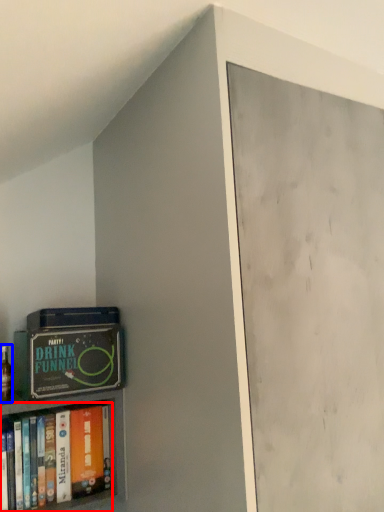
Question: Which object appears closest to the camera in this image, book (highlighted by a red box) or alcohol (highlighted by a blue box)?

Choices:
 (A) book
 (B) alcohol

Answer: (A)